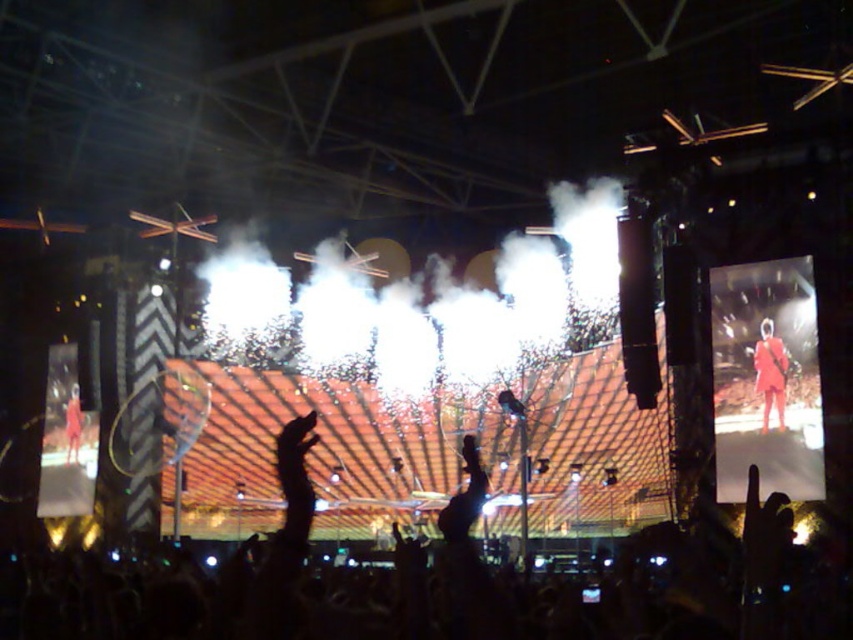
Question: In this image, where is matte red dress at center located relative to orange fabric person at left?

Choices:
 (A) left
 (B) right

Answer: (B)

Question: Where is black matte hand at center located in relation to matte red dress at center in the image?

Choices:
 (A) right
 (B) left

Answer: (B)

Question: Among these objects, which one is nearest to the camera?

Choices:
 (A) black matte hand at center
 (B) orange fabric person at left
 (C) matte red dress at center

Answer: (A)

Question: Can you confirm if matte red dress at center is thinner than orange fabric person at left?

Choices:
 (A) yes
 (B) no

Answer: (A)

Question: Which point is farther to the camera?

Choices:
 (A) matte red dress at center
 (B) orange fabric person at left

Answer: (B)

Question: Which point is closer to the camera taking this photo?

Choices:
 (A) (764, 342)
 (B) (70, 460)
 (C) (445, 515)

Answer: (C)